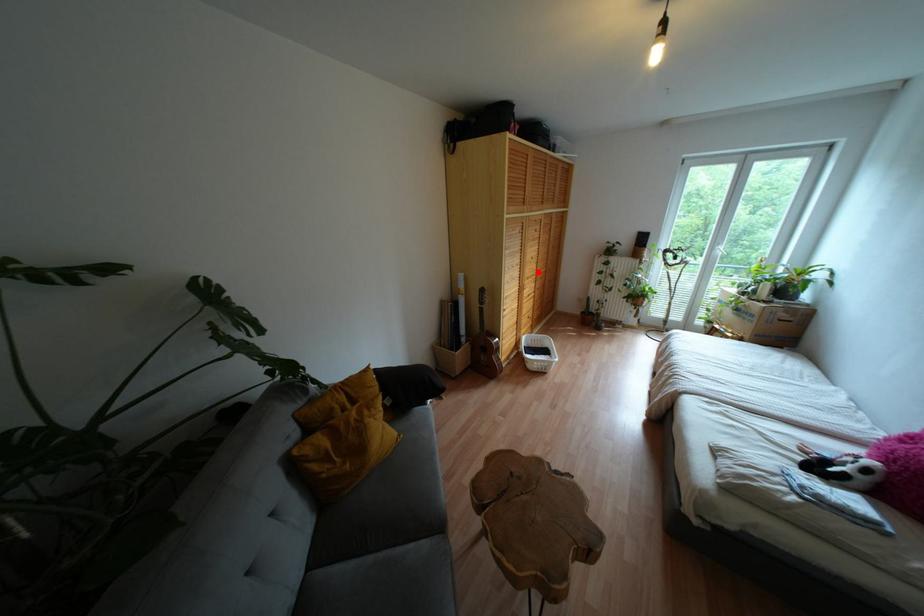
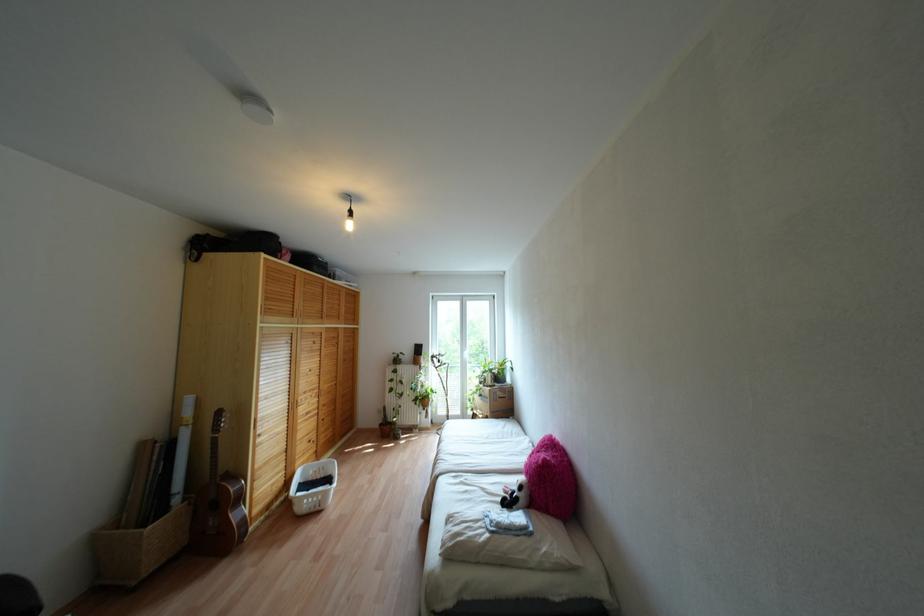
Question: I am providing you with two images of the same scene from different viewpoints. A red point is marked on the first image. At the location where the point appears in image 1, is it still visible in image 2?

Choices:
 (A) Yes
 (B) No

Answer: (A)